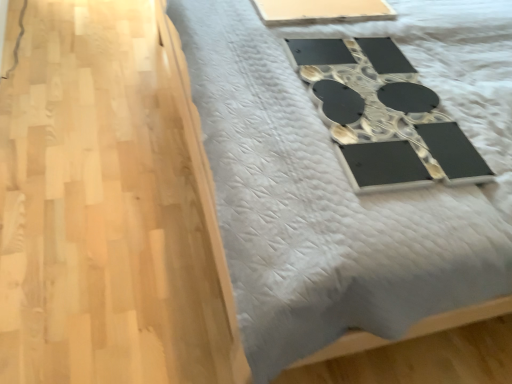
What do you see at coordinates (344, 180) in the screenshot?
I see `black glossy mirror at upper center` at bounding box center [344, 180].

What is the approximate height of black glossy mirror at upper center?

It is 1.37 inches.

Image resolution: width=512 pixels, height=384 pixels. What are the coordinates of `black glossy mirror at upper center` in the screenshot? It's located at (344, 180).

Find the location of a particular element. The height and width of the screenshot is (384, 512). white plastic tray at upper center is located at coordinates (322, 11).

This screenshot has height=384, width=512. Describe the element at coordinates (322, 11) in the screenshot. I see `white plastic tray at upper center` at that location.

Identify the location of black glossy mirror at upper center. Image resolution: width=512 pixels, height=384 pixels. coord(344,180).

Consider the image. Considering the positions of objects white plastic tray at upper center and black glossy mirror at upper center in the image provided, who is more to the right, white plastic tray at upper center or black glossy mirror at upper center?

white plastic tray at upper center.

Does white plastic tray at upper center come behind black glossy mirror at upper center?

Yes.

Which is nearer, (350, 4) or (312, 207)?

Point (350, 4) appears to be farther away from the viewer than point (312, 207).

From the image's perspective, is white plastic tray at upper center below black glossy mirror at upper center?

No.

From a real-world perspective, does white plastic tray at upper center stand above black glossy mirror at upper center?

Indeed, from a real-world perspective, white plastic tray at upper center stands above black glossy mirror at upper center.

Which of these two, white plastic tray at upper center or black glossy mirror at upper center, is thinner?

white plastic tray at upper center is thinner.

Who is shorter, white plastic tray at upper center or black glossy mirror at upper center?

white plastic tray at upper center is shorter.

From the picture: Looking at the image, does white plastic tray at upper center seem bigger or smaller compared to black glossy mirror at upper center?

white plastic tray at upper center is smaller than black glossy mirror at upper center.

Can black glossy mirror at upper center be found inside white plastic tray at upper center?

Actually, black glossy mirror at upper center is outside white plastic tray at upper center.

Looking at this image, is white plastic tray at upper center next to black glossy mirror at upper center?

They are not placed beside each other.

Could you tell me if white plastic tray at upper center is turned towards black glossy mirror at upper center?

No, white plastic tray at upper center is not facing towards black glossy mirror at upper center.

The height and width of the screenshot is (384, 512). In order to click on furniture on the left of the white plastic tray at upper center in this screenshot , I will do `click(344, 180)`.

Considering the relative positions of black glossy mirror at upper center and white plastic tray at upper center in the image provided, is black glossy mirror at upper center to the left or to the right of white plastic tray at upper center?

From the image, it's evident that black glossy mirror at upper center is to the left of white plastic tray at upper center.

Which object is further away from the camera taking this photo, black glossy mirror at upper center or white plastic tray at upper center?

white plastic tray at upper center is behind.

Is point (256, 263) less distant than point (328, 6)?

Yes.

From the image's perspective, would you say black glossy mirror at upper center is shown under white plastic tray at upper center?

Yes.

From a real-world perspective, relative to white plastic tray at upper center, is black glossy mirror at upper center vertically above or below?

From a real-world perspective, black glossy mirror at upper center is physically below white plastic tray at upper center.

Looking at their sizes, would you say black glossy mirror at upper center is wider or thinner than white plastic tray at upper center?

black glossy mirror at upper center is wider than white plastic tray at upper center.

Which of these two, black glossy mirror at upper center or white plastic tray at upper center, stands taller?

With more height is black glossy mirror at upper center.

Considering the sizes of objects black glossy mirror at upper center and white plastic tray at upper center in the image provided, who is smaller, black glossy mirror at upper center or white plastic tray at upper center?

white plastic tray at upper center.

Is black glossy mirror at upper center spatially inside white plastic tray at upper center, or outside of it?

black glossy mirror at upper center lies outside white plastic tray at upper center.

Is the surface of black glossy mirror at upper center in direct contact with white plastic tray at upper center?

No, black glossy mirror at upper center is not with white plastic tray at upper center.

Is black glossy mirror at upper center oriented away from white plastic tray at upper center?

black glossy mirror at upper center is not turned away from white plastic tray at upper center.

Measure the distance between black glossy mirror at upper center and white plastic tray at upper center.

black glossy mirror at upper center and white plastic tray at upper center are 13.78 inches apart from each other.

You are a GUI agent. You are given a task and a screenshot of the screen. Output one action in this format:
    pyautogui.click(x=<x>, y=<y>)
    Task: Click on the furniture located on the left of white plastic tray at upper center
    
    Given the screenshot: What is the action you would take?
    pyautogui.click(x=344, y=180)

Where is `furniture that is under the white plastic tray at upper center (from a real-world perspective)`? The image size is (512, 384). furniture that is under the white plastic tray at upper center (from a real-world perspective) is located at coordinates (344, 180).

Locate an element on the screen. furniture in front of the white plastic tray at upper center is located at coordinates (344, 180).